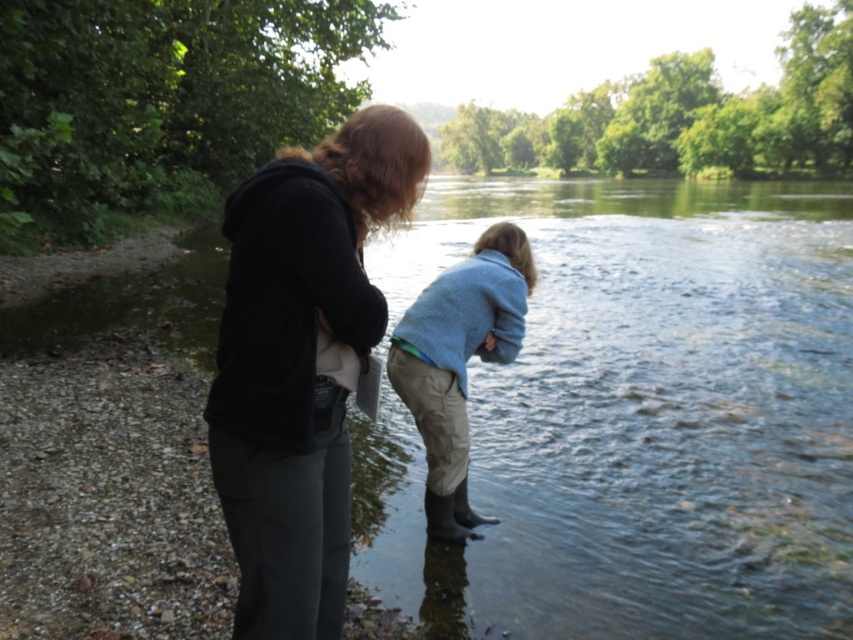
Question: Does matte black hoodie at center have a smaller size compared to light blue sweater at center?

Choices:
 (A) yes
 (B) no

Answer: (A)

Question: Which object appears farthest from the camera in this image?

Choices:
 (A) matte black hoodie at center
 (B) light blue sweater at center

Answer: (B)

Question: Which of the following is the farthest from the observer?

Choices:
 (A) (289, 316)
 (B) (440, 468)

Answer: (B)

Question: In this image, where is matte black hoodie at center located relative to light blue sweater at center?

Choices:
 (A) right
 (B) left

Answer: (B)

Question: Is matte black hoodie at center to the right of light blue sweater at center from the viewer's perspective?

Choices:
 (A) yes
 (B) no

Answer: (B)

Question: Which of the following is the closest to the observer?

Choices:
 (A) (282, 628)
 (B) (424, 422)

Answer: (A)